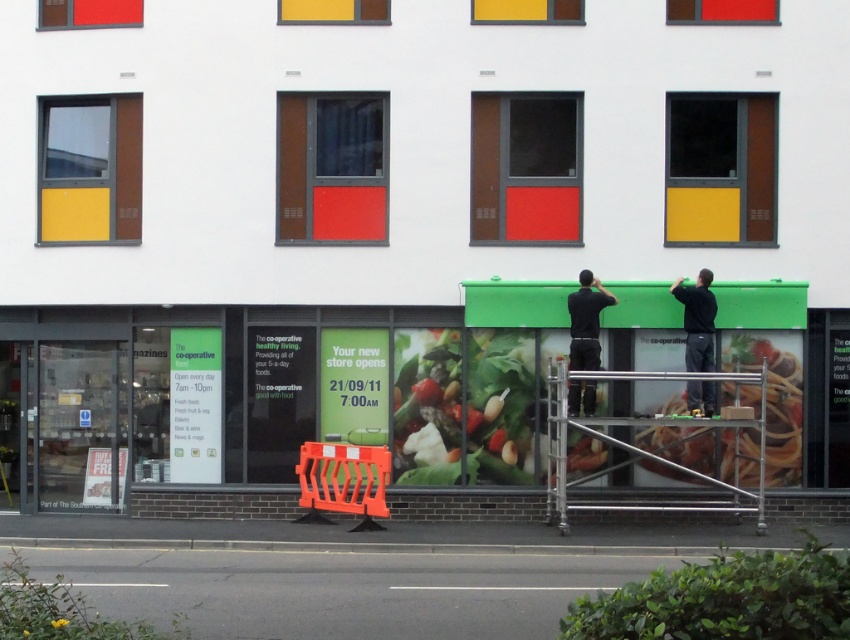
Question: Is green matte spaghetti at lower right thinner than dark gray shirt at center?

Choices:
 (A) no
 (B) yes

Answer: (A)

Question: Can you confirm if green matte vegetable at center is bigger than dark gray shirt at center?

Choices:
 (A) yes
 (B) no

Answer: (B)

Question: Which point is farther from the camera taking this photo?

Choices:
 (A) (694, 314)
 (B) (660, 365)
 (C) (503, 332)

Answer: (B)

Question: Which object is the closest to the dark gray shirt at center?

Choices:
 (A) green matte spaghetti at lower right
 (B) green matte vegetable at center

Answer: (A)

Question: Which object is farther from the camera taking this photo?

Choices:
 (A) black matte shirt at center
 (B) dark gray shirt at center
 (C) green matte vegetable at center
 (D) green matte spaghetti at lower right

Answer: (C)

Question: Considering the relative positions of green matte spaghetti at lower right and dark gray shirt at center in the image provided, where is green matte spaghetti at lower right located with respect to dark gray shirt at center?

Choices:
 (A) left
 (B) right

Answer: (B)